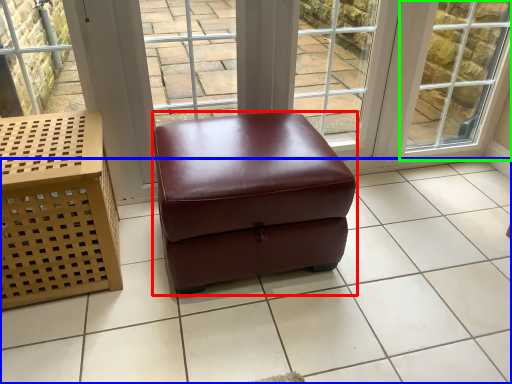
Question: Considering the real-world distances, which object is farthest from stool (highlighted by a red box)? tile (highlighted by a blue box) or window (highlighted by a green box)?

Choices:
 (A) tile
 (B) window

Answer: (B)